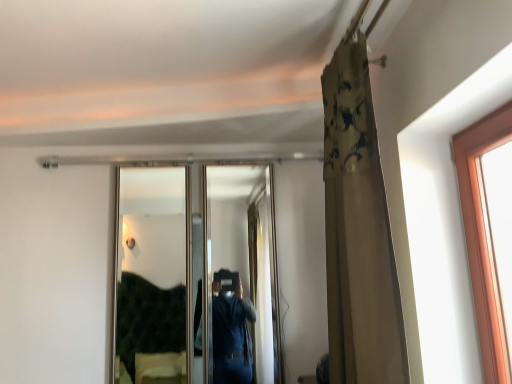
Question: From the image's perspective, relative to floral fabric curtain at upper right, is clear glass mirror at center above or below?

Choices:
 (A) above
 (B) below

Answer: (B)

Question: From a real-world perspective, is clear glass mirror at center positioned above or below floral fabric curtain at upper right?

Choices:
 (A) above
 (B) below

Answer: (B)

Question: Would you say clear glass mirror at center is to the left or to the right of floral fabric curtain at upper right in the picture?

Choices:
 (A) right
 (B) left

Answer: (B)

Question: Considering the positions of floral fabric curtain at upper right and clear glass mirror at center in the image, is floral fabric curtain at upper right wider or thinner than clear glass mirror at center?

Choices:
 (A) wide
 (B) thin

Answer: (A)

Question: In terms of size, does floral fabric curtain at upper right appear bigger or smaller than clear glass mirror at center?

Choices:
 (A) big
 (B) small

Answer: (A)

Question: From a real-world perspective, is floral fabric curtain at upper right positioned above or below clear glass mirror at center?

Choices:
 (A) below
 (B) above

Answer: (B)

Question: In the image, is floral fabric curtain at upper right positioned in front of or behind clear glass mirror at center?

Choices:
 (A) front
 (B) behind

Answer: (A)